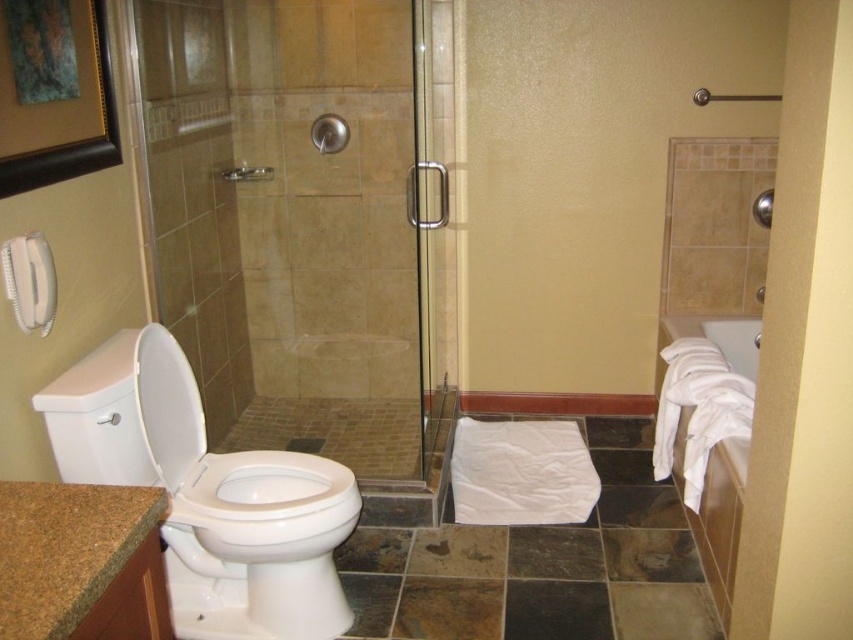
Question: Does transparent glass shower door at center appear under clear glass shower door at center?

Choices:
 (A) no
 (B) yes

Answer: (B)

Question: Estimate the real-world distances between objects in this image. Which object is farther from the transparent glass shower door at center?

Choices:
 (A) white glossy toilet bowl at lower left
 (B) clear glass shower door at center
 (C) brushed metal shower at upper center

Answer: (A)

Question: Estimate the real-world distances between objects in this image. Which object is closer to the clear glass shower door at center?

Choices:
 (A) brushed metal shower at upper center
 (B) white glossy toilet bowl at left
 (C) transparent glass shower door at center

Answer: (C)

Question: Where is clear glass shower door at center located in relation to brushed metal shower at upper center in the image?

Choices:
 (A) above
 (B) below

Answer: (B)

Question: Is white glossy toilet bowl at lower left behind brushed metal shower at upper center?

Choices:
 (A) yes
 (B) no

Answer: (B)

Question: Which of the following is the farthest from the observer?

Choices:
 (A) brushed metal shower at upper center
 (B) white glossy toilet bowl at lower left
 (C) clear glass shower door at center

Answer: (A)